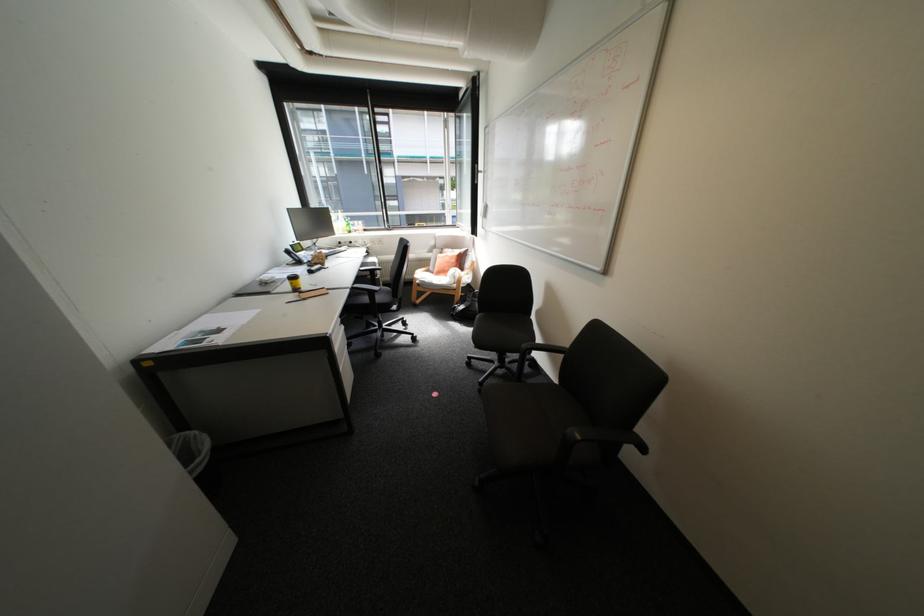
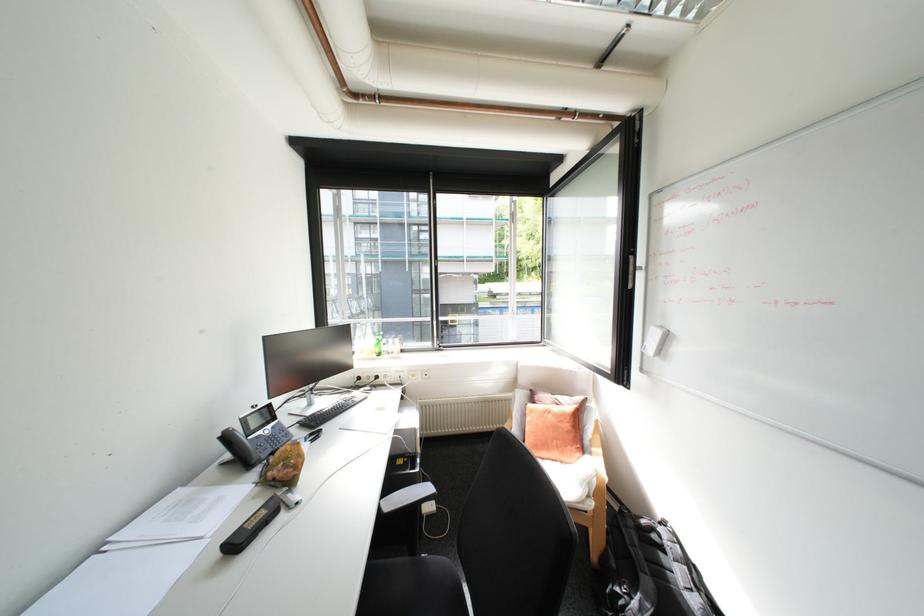
Which direction would the cameraman need to move to produce the second image?

The cameraman moved toward left, forward.